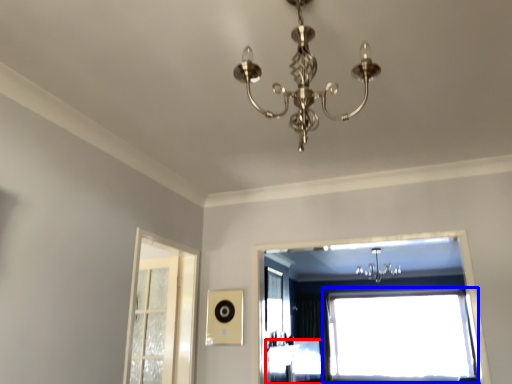
Question: Which object is closer to the camera taking this photo, furniture (highlighted by a red box) or window (highlighted by a blue box)?

Choices:
 (A) furniture
 (B) window

Answer: (A)